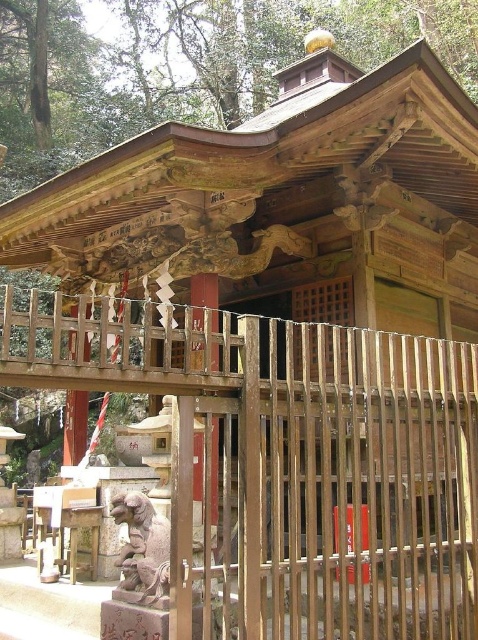
Question: Does brown wooden pillar at center appear over white painted wood at left?

Choices:
 (A) yes
 (B) no

Answer: (A)

Question: Which point appears closest to the camera in this image?

Choices:
 (A) (76, 461)
 (B) (199, 451)

Answer: (B)

Question: Does brown wooden pillar at center have a smaller size compared to white painted wood at left?

Choices:
 (A) yes
 (B) no

Answer: (B)

Question: Which point is closer to the camera?

Choices:
 (A) (213, 449)
 (B) (74, 396)

Answer: (A)

Question: Is the position of brown wooden pillar at center less distant than that of white painted wood at left?

Choices:
 (A) no
 (B) yes

Answer: (B)

Question: Among these objects, which one is farthest from the camera?

Choices:
 (A) white painted wood at left
 (B) brown wooden pillar at center

Answer: (A)